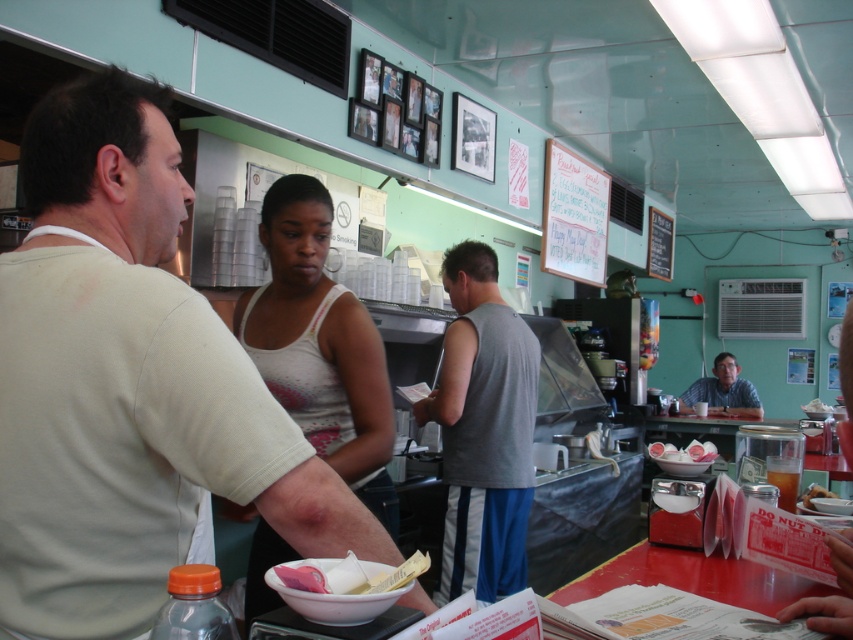
Does light beige t-shirt at center have a smaller size compared to white matte bowl at lower center?

No.

Is light beige t-shirt at center to the right of white matte bowl at lower center from the viewer's perspective?

In fact, light beige t-shirt at center is to the left of white matte bowl at lower center.

What do you see at coordinates (128, 385) in the screenshot? The width and height of the screenshot is (853, 640). I see `light beige t-shirt at center` at bounding box center [128, 385].

Find the location of a particular element. The width and height of the screenshot is (853, 640). light beige t-shirt at center is located at coordinates (128, 385).

Does white matte bowl at lower center have a larger size compared to golden brown donut at right?

No.

Does white matte bowl at lower center have a greater width compared to golden brown donut at right?

In fact, white matte bowl at lower center might be narrower than golden brown donut at right.

Is point (349, 596) behind point (807, 499)?

No, it is not.

Find the location of a particular element. The width and height of the screenshot is (853, 640). white matte bowl at lower center is located at coordinates (335, 602).

Does light beige t-shirt at center have a greater height compared to golden brown donut at right?

Yes, light beige t-shirt at center is taller than golden brown donut at right.

Can you confirm if light beige t-shirt at center is wider than golden brown donut at right?

Yes, light beige t-shirt at center is wider than golden brown donut at right.

Is point (194, 470) in front of point (811, 493)?

Yes, it is in front of point (811, 493).

Identify the location of light beige t-shirt at center. (128, 385).